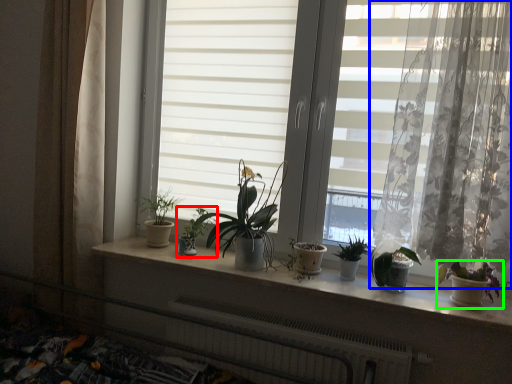
Question: Which object is positioned farthest from houseplant (highlighted by a red box)? Select from curtain (highlighted by a blue box) and houseplant (highlighted by a green box).

Choices:
 (A) curtain
 (B) houseplant

Answer: (B)